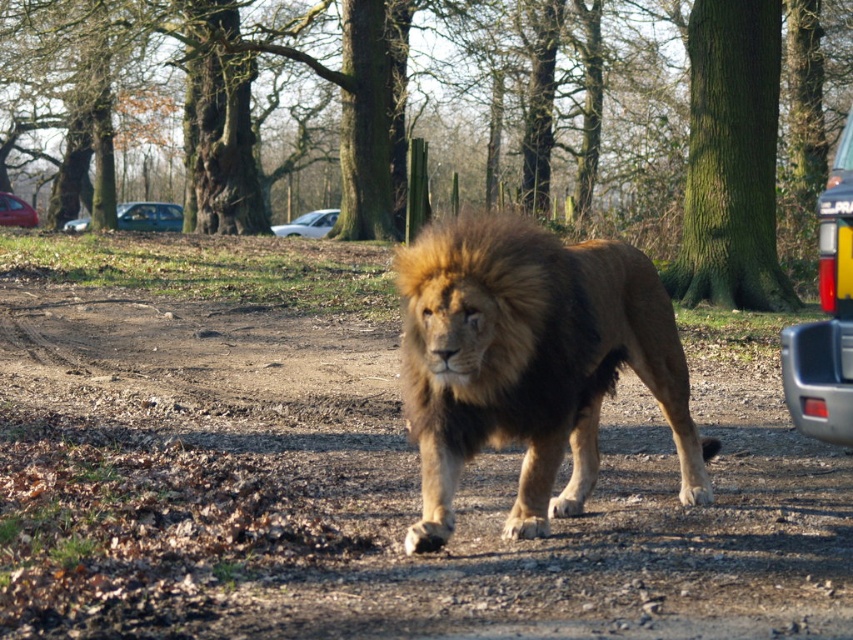
Can you confirm if brown furry lion at center is positioned to the right of metallic blue sedan at left?

Correct, you'll find brown furry lion at center to the right of metallic blue sedan at left.

Does brown furry lion at center have a lesser height compared to metallic blue sedan at left?

Yes, brown furry lion at center is shorter than metallic blue sedan at left.

Does point (492, 385) lie behind point (131, 205)?

No, (492, 385) is closer to viewer.

Locate an element on the screen. brown furry lion at center is located at coordinates (529, 362).

Is brown fuzzy mane at center positioned behind white matte car at center?

No, brown fuzzy mane at center is closer to the viewer.

Does point (524, 305) come closer to viewer compared to point (323, 234)?

Yes, point (524, 305) is in front of point (323, 234).

Which is in front, point (427, 301) or point (292, 224)?

Positioned in front is point (427, 301).

The height and width of the screenshot is (640, 853). I want to click on brown fuzzy mane at center, so (480, 262).

Is point (323, 500) less distant than point (474, 227)?

No, (323, 500) is behind (474, 227).

Is the position of brown dirt track at center more distant than that of brown fuzzy mane at center?

No, brown dirt track at center is closer to the viewer.

Where is `brown dirt track at center`? brown dirt track at center is located at coordinates (370, 492).

At what (x,y) coordinates should I click in order to perform the action: click on brown dirt track at center. Please return your answer as a coordinate pair (x, y). Image resolution: width=853 pixels, height=640 pixels. Looking at the image, I should click on pos(370,492).